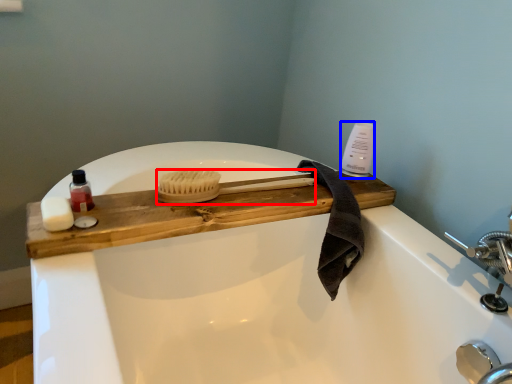
Question: Which object is closer to the camera taking this photo, brush (highlighted by a red box) or cleaning product (highlighted by a blue box)?

Choices:
 (A) brush
 (B) cleaning product

Answer: (A)